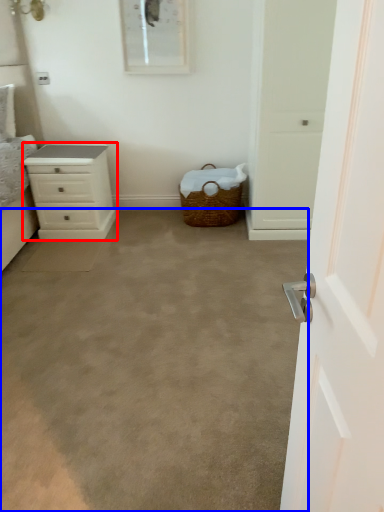
Question: Which of the following is the farthest to the observer, chest of drawers (highlighted by a red box) or plain (highlighted by a blue box)?

Choices:
 (A) chest of drawers
 (B) plain

Answer: (A)